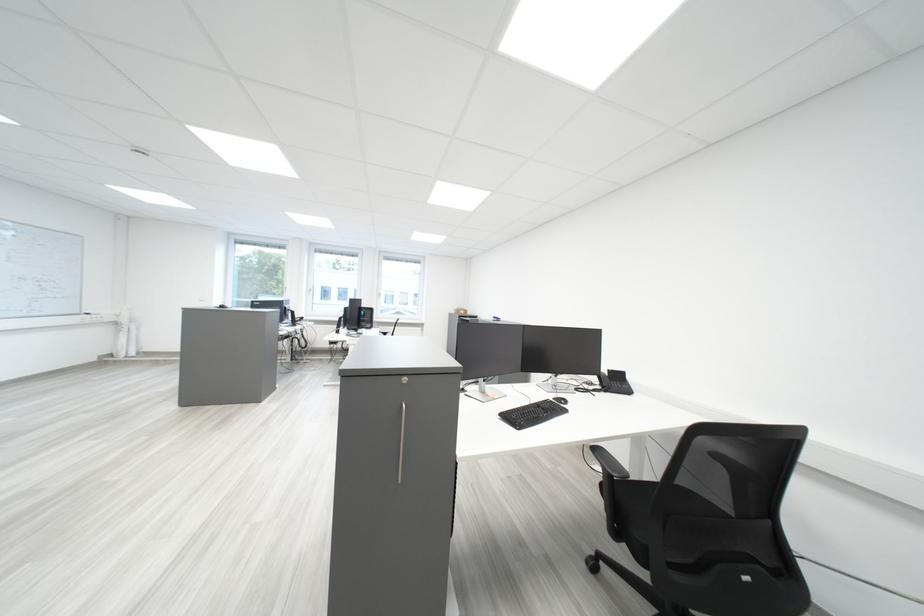
At what (x,y) coordinates should I click in order to perform the action: click on chair armrest. Please return your answer as a coordinate pair (x, y). This screenshot has height=616, width=924. Looking at the image, I should click on (619, 451).